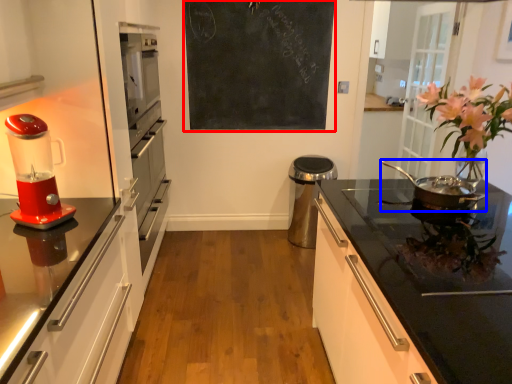
Question: Which point is further to the camera, bulletin board (highlighted by a red box) or kitchen appliance (highlighted by a blue box)?

Choices:
 (A) bulletin board
 (B) kitchen appliance

Answer: (A)